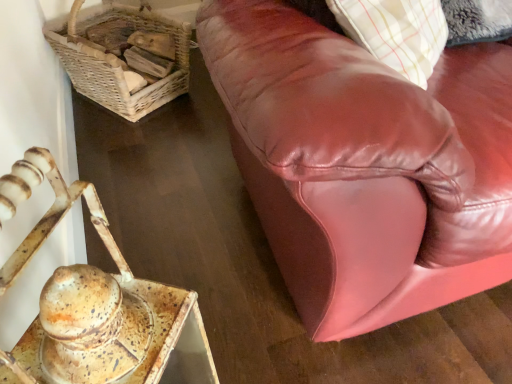
Question: From the image's perspective, is woven wicker basket at upper left located above or below rusty metal tray at lower left?

Choices:
 (A) below
 (B) above

Answer: (B)

Question: From their relative heights in the image, would you say woven wicker basket at upper left is taller or shorter than rusty metal tray at lower left?

Choices:
 (A) tall
 (B) short

Answer: (B)

Question: Considering the real-world distances, which object is closest to the rusty metal tray at lower left?

Choices:
 (A) woven wicker basket at upper left
 (B) shiny brown leather couch at upper right

Answer: (B)

Question: Estimate the real-world distances between objects in this image. Which object is closer to the woven wicker basket at upper left?

Choices:
 (A) shiny brown leather couch at upper right
 (B) rusty metal tray at lower left

Answer: (B)